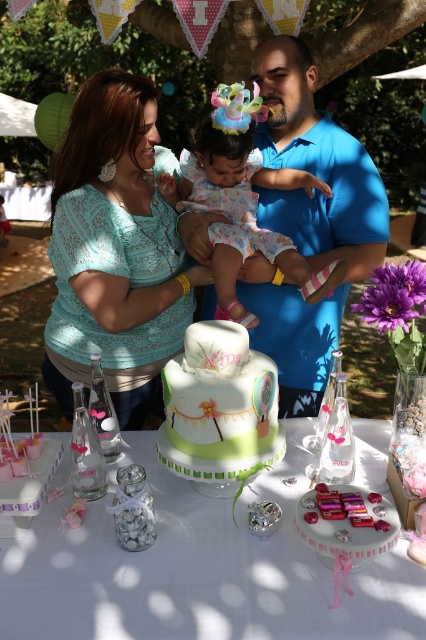
Question: Which object is closer to the camera taking this photo?

Choices:
 (A) pastel floral dress at center
 (B) blue cotton shirt at center

Answer: (B)

Question: Is pastel green cake at center below matte teal lace blouse at center?

Choices:
 (A) no
 (B) yes

Answer: (B)

Question: Does pastel green cake at center have a lesser width compared to white fondant cake at center?

Choices:
 (A) no
 (B) yes

Answer: (A)

Question: Which point appears closest to the camera in this image?

Choices:
 (A) (181, 529)
 (B) (362, 176)

Answer: (A)

Question: Does white fondant cake at center have a lesser width compared to pastel floral dress at center?

Choices:
 (A) yes
 (B) no

Answer: (A)

Question: Among these objects, which one is nearest to the camera?

Choices:
 (A) pastel green cake at center
 (B) matte teal lace blouse at center
 (C) pastel floral dress at center
 (D) white fondant cake at center

Answer: (A)